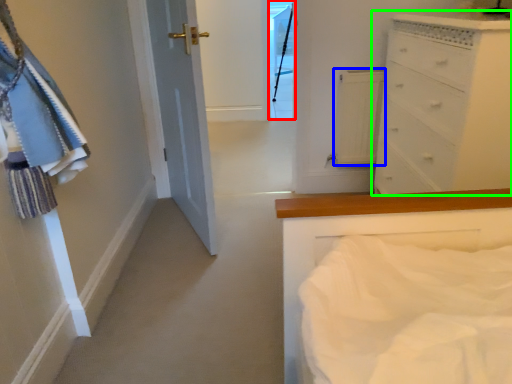
Question: Estimate the real-world distances between objects in this image. Which object is farther from glass door (highlighted by a red box), cabinetry (highlighted by a blue box) or chest of drawers (highlighted by a green box)?

Choices:
 (A) cabinetry
 (B) chest of drawers

Answer: (B)